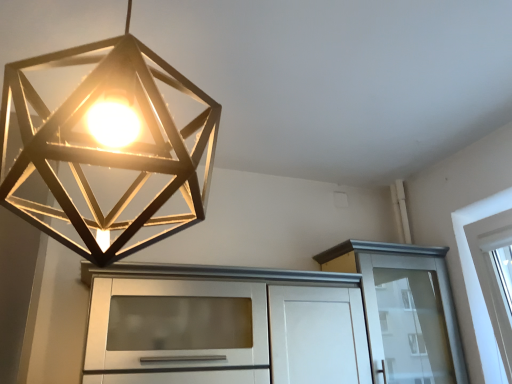
Question: Are metallic geometric light at upper center and white glossy cabinet at upper right, positioned as the first cabinetry in right-to-left order, making contact?

Choices:
 (A) yes
 (B) no

Answer: (B)

Question: Is metallic geometric light at upper center positioned far away from white glossy cabinet at upper right, positioned as the first cabinetry in right-to-left order?

Choices:
 (A) yes
 (B) no

Answer: (A)

Question: Is the position of metallic geometric light at upper center less distant than that of white glossy cabinet at upper right, the 2th cabinetry from the left?

Choices:
 (A) yes
 (B) no

Answer: (A)

Question: Can you confirm if metallic geometric light at upper center is positioned to the right of white glossy cabinet at upper right, positioned as the first cabinetry in right-to-left order?

Choices:
 (A) no
 (B) yes

Answer: (A)

Question: Is metallic geometric light at upper center at the left side of white glossy cabinet at upper right, positioned as the first cabinetry in right-to-left order?

Choices:
 (A) yes
 (B) no

Answer: (A)

Question: Based on their positions, is white glossy cabinet at upper right, the 2th cabinetry from the left, located to the left or right of metallic geometric light at upper center?

Choices:
 (A) left
 (B) right

Answer: (B)

Question: Looking at their shapes, would you say white glossy cabinet at upper right, positioned as the first cabinetry in right-to-left order, is wider or thinner than metallic geometric light at upper center?

Choices:
 (A) wide
 (B) thin

Answer: (B)

Question: In terms of height, does white glossy cabinet at upper right, positioned as the first cabinetry in right-to-left order, look taller or shorter compared to metallic geometric light at upper center?

Choices:
 (A) short
 (B) tall

Answer: (A)

Question: From the image's perspective, relative to metallic geometric light at upper center, is white glossy cabinet at upper right, positioned as the first cabinetry in right-to-left order, above or below?

Choices:
 (A) below
 (B) above

Answer: (A)

Question: In terms of size, does metallic geometric light at upper center appear bigger or smaller than white glossy cabinet at center, which appears as the first cabinetry when viewed from the left?

Choices:
 (A) small
 (B) big

Answer: (A)

Question: Is metallic geometric light at upper center wider or thinner than white glossy cabinet at center, which appears as the first cabinetry when viewed from the left?

Choices:
 (A) wide
 (B) thin

Answer: (B)

Question: In the image, is metallic geometric light at upper center on the left side or the right side of white glossy cabinet at center, the 2th cabinetry viewed from the right?

Choices:
 (A) left
 (B) right

Answer: (A)

Question: Is metallic geometric light at upper center spatially inside white glossy cabinet at center, which appears as the first cabinetry when viewed from the left, or outside of it?

Choices:
 (A) outside
 (B) inside

Answer: (A)

Question: From a real-world perspective, is white glossy cabinet at center, which appears as the first cabinetry when viewed from the left, physically located above or below metallic geometric light at upper center?

Choices:
 (A) above
 (B) below

Answer: (B)

Question: From the image's perspective, is white glossy cabinet at center, which appears as the first cabinetry when viewed from the left, located above or below metallic geometric light at upper center?

Choices:
 (A) above
 (B) below

Answer: (B)